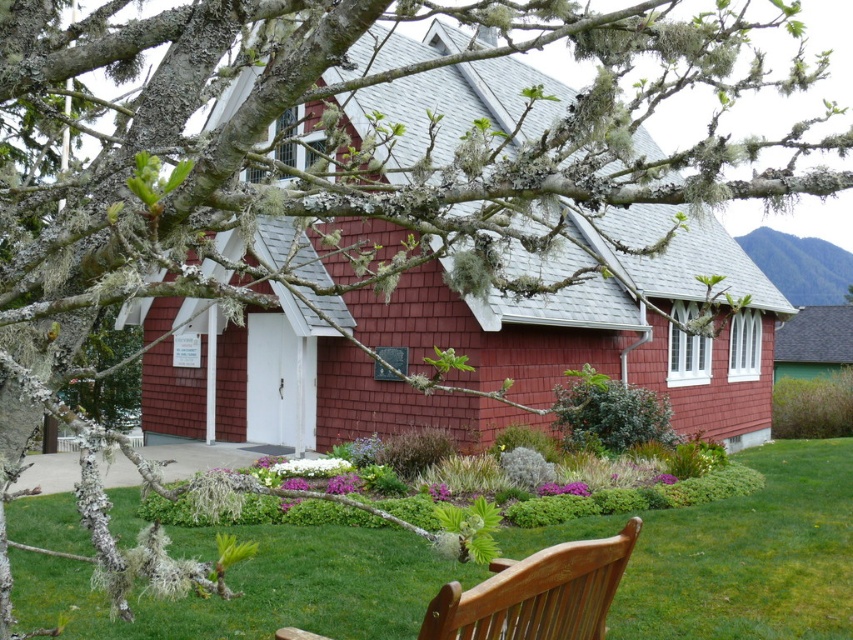
You are standing at the entrance of the red shingle building with white trim and want to sit on the wooden bench. According to the image, where is the green grass at lower center located relative to your current position?

The green grass at lower center is located at point (749, 556), which means it is positioned to your lower right side relative to your current position at the entrance.

You are standing at the entrance of the red shingle cottage at center. If you walk straight ahead, will you immediately encounter the wooden bench positioned on the grassy lawn?

The red shingle cottage at center is located at point (601, 330). Since the bench is in the foreground facing the building, walking straight ahead from the entrance would lead you towards the bench, so yes, you would encounter the wooden bench positioned on the grassy lawn immediately.